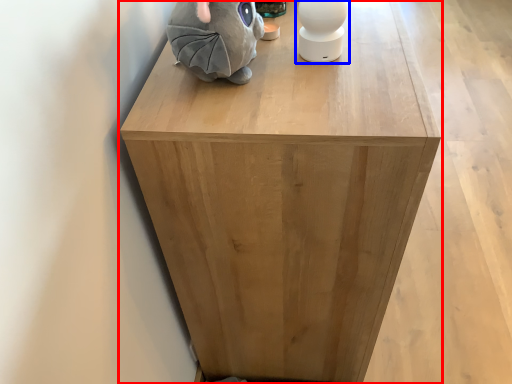
Question: Which of the following is the farthest to the observer, furniture (highlighted by a red box) or toy (highlighted by a blue box)?

Choices:
 (A) furniture
 (B) toy

Answer: (B)